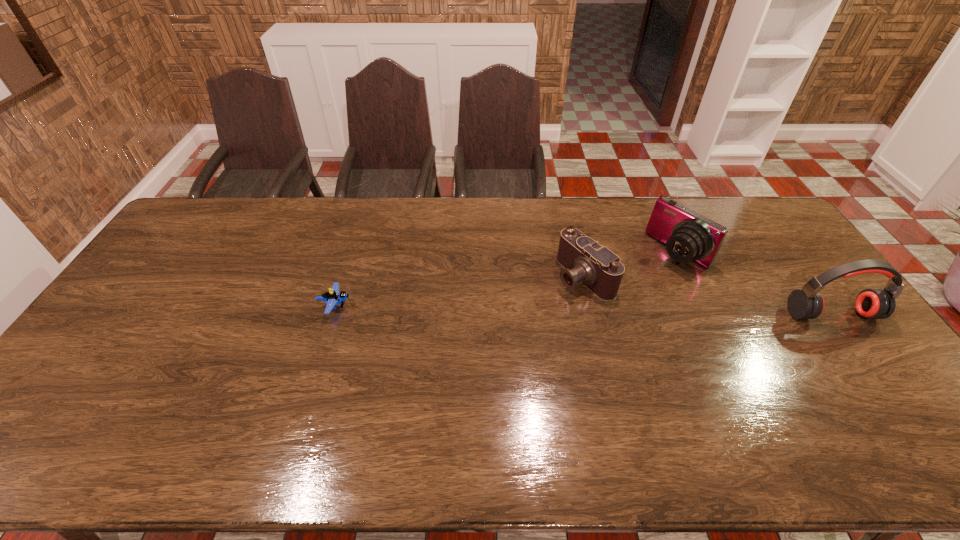
At what (x,y) coordinates should I click in order to perform the action: click on free space at the left edge. Please return your answer as a coordinate pair (x, y). The image size is (960, 540). Looking at the image, I should click on (143, 311).

The height and width of the screenshot is (540, 960). In the image, there is a desktop. Identify the location of vacant space at the right edge. (781, 296).

Where is `vacant space at the far left corner of the desktop`? The height and width of the screenshot is (540, 960). vacant space at the far left corner of the desktop is located at coordinates (216, 218).

Locate an element on the screen. This screenshot has height=540, width=960. unoccupied area between the leftmost object and the second shortest object is located at coordinates (460, 291).

Identify the location of vacant area that lies between the shortest object and the rightmost object. (584, 310).

Identify the location of free space between the shortest object and the taller camera. (507, 279).

Where is `free point between the rightmost object and the right camera`? The height and width of the screenshot is (540, 960). free point between the rightmost object and the right camera is located at coordinates (755, 284).

Where is `free spot between the shortest object and the earphone`? The height and width of the screenshot is (540, 960). free spot between the shortest object and the earphone is located at coordinates (584, 310).

This screenshot has width=960, height=540. I want to click on empty location between the leftmost object and the left camera, so point(460,291).

Image resolution: width=960 pixels, height=540 pixels. What are the coordinates of `blank region between the shortest object and the third shortest object` in the screenshot? It's located at (507, 279).